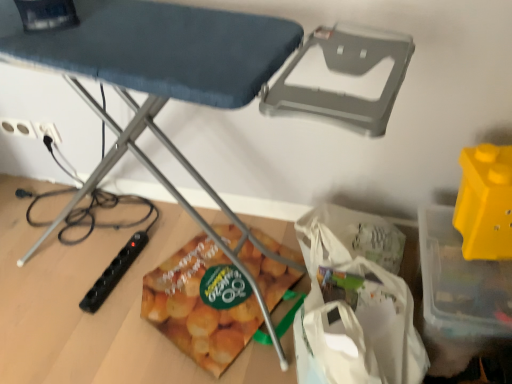
Question: Should I look upward or downward to see black plastic power strip at lower left, marked as the first toy in a left-to-right arrangement?

Choices:
 (A) up
 (B) down

Answer: (B)

Question: Can you confirm if matte plastic snack bag at lower center is shorter than metallic ironing board at center?

Choices:
 (A) yes
 (B) no

Answer: (A)

Question: Can you confirm if matte plastic snack bag at lower center is taller than metallic ironing board at center?

Choices:
 (A) yes
 (B) no

Answer: (B)

Question: Can you confirm if matte plastic snack bag at lower center is thinner than metallic ironing board at center?

Choices:
 (A) yes
 (B) no

Answer: (A)

Question: Is matte plastic snack bag at lower center positioned far away from metallic ironing board at center?

Choices:
 (A) no
 (B) yes

Answer: (A)

Question: From the image's perspective, is matte plastic snack bag at lower center under metallic ironing board at center?

Choices:
 (A) yes
 (B) no

Answer: (A)

Question: From a real-world perspective, is matte plastic snack bag at lower center located higher than metallic ironing board at center?

Choices:
 (A) no
 (B) yes

Answer: (A)

Question: Can you confirm if matte plastic snack bag at lower center is bigger than black plastic power strip at lower left, marked as the 1th toy in a bottom-to-top arrangement?

Choices:
 (A) no
 (B) yes

Answer: (B)

Question: Is matte plastic snack bag at lower center facing away from black plastic power strip at lower left, the second toy positioned from the top?

Choices:
 (A) yes
 (B) no

Answer: (A)

Question: Can you confirm if matte plastic snack bag at lower center is shorter than black plastic power strip at lower left, marked as the 1th toy in a bottom-to-top arrangement?

Choices:
 (A) no
 (B) yes

Answer: (A)

Question: Is matte plastic snack bag at lower center beside black plastic power strip at lower left, marked as the first toy in a left-to-right arrangement?

Choices:
 (A) no
 (B) yes

Answer: (A)

Question: Is matte plastic snack bag at lower center further to the viewer compared to black plastic power strip at lower left, placed as the second toy when sorted from right to left?

Choices:
 (A) yes
 (B) no

Answer: (B)

Question: Does matte plastic snack bag at lower center have a lesser width compared to black plastic power strip at lower left, marked as the first toy in a left-to-right arrangement?

Choices:
 (A) yes
 (B) no

Answer: (B)

Question: Is white fabric grocery bag at lower center oriented towards matte plastic snack bag at lower center?

Choices:
 (A) yes
 (B) no

Answer: (A)